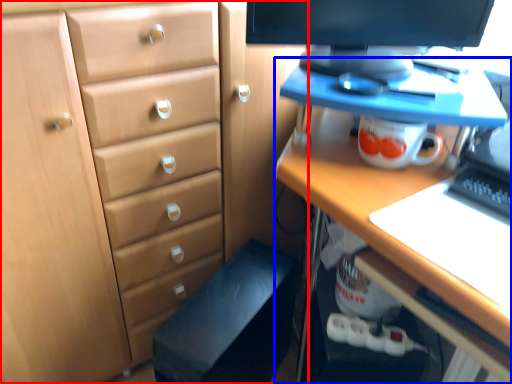
Question: Which object is closer to the camera taking this photo, chest of drawers (highlighted by a red box) or desk (highlighted by a blue box)?

Choices:
 (A) chest of drawers
 (B) desk

Answer: (B)